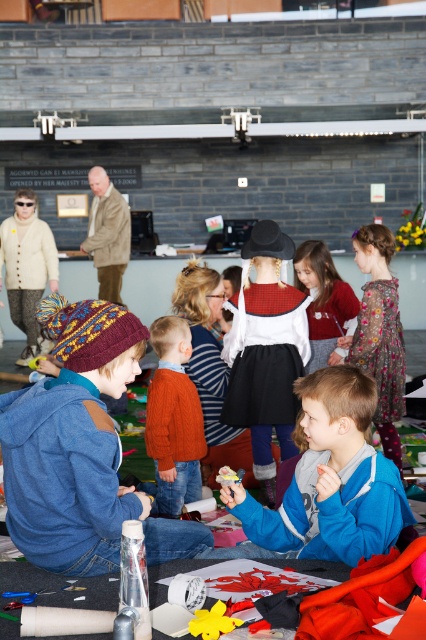
You are a tailor measuring jackets for a community event. You have a storage box that can only fit items wider than 30 cm. Based on the scene, can both the blue fleece jacket at center and the velvet red sweater at center fit into the box?

The blue fleece jacket at center is wider than the velvet red sweater at center. Since the box requires items wider than 30 cm, we need to know the exact width of the narrower item. However, the description only states the relative width between them. Without specific measurements, we can only confirm the blue fleece jacket at center is wider, but cannot determine if both meet the 30 cm requirement.

What is the exact location of the blue fleece jacket at center in the image?

The blue fleece jacket at center is located at point coordinates of (331, 477).

You are a photographer standing at the camera position. You want to take a closeup photo of the orange knitted sweater at center. Is the sweater within your reach to adjust its position before taking the photo?

The orange knitted sweater at center is 4.57 meters from camera, so it is too far away to reach and adjust its position manually. You would need to move closer or use a telephoto lens for the closeup.